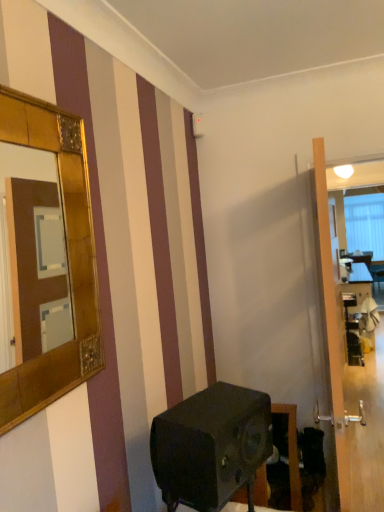
This screenshot has height=512, width=384. What do you see at coordinates (211, 446) in the screenshot?
I see `matte black speaker at lower center` at bounding box center [211, 446].

The image size is (384, 512). I want to click on matte black speaker at lower center, so click(211, 446).

The width and height of the screenshot is (384, 512). In order to click on gold textured mirror at upper left in this screenshot , I will do `click(67, 260)`.

Considering the sizes of objects transparent glass door at right and matte black speaker at lower center in the image provided, who is shorter, transparent glass door at right or matte black speaker at lower center?

matte black speaker at lower center.

Would you say transparent glass door at right is outside matte black speaker at lower center?

Yes, transparent glass door at right is located beyond the bounds of matte black speaker at lower center.

The height and width of the screenshot is (512, 384). I want to click on glass door above the matte black speaker at lower center (from the image's perspective), so click(x=353, y=388).

In the scene shown: Is gold textured mirror at upper left oriented away from matte black speaker at lower center?

No, matte black speaker at lower center is not at the back of gold textured mirror at upper left.

Is gold textured mirror at upper left not within matte black speaker at lower center?

gold textured mirror at upper left lies outside matte black speaker at lower center's area.

Between gold textured mirror at upper left and matte black speaker at lower center, which one has less height?

matte black speaker at lower center.

In the image, there is a gold textured mirror at upper left. Where is `appliance below it (from a real-world perspective)`? The height and width of the screenshot is (512, 384). appliance below it (from a real-world perspective) is located at coordinates (211, 446).

Considering the sizes of matte black speaker at lower center and transparent glass door at right in the image, is matte black speaker at lower center taller or shorter than transparent glass door at right?

matte black speaker at lower center is shorter than transparent glass door at right.

Can you confirm if matte black speaker at lower center is positioned to the right of transparent glass door at right?

Incorrect, matte black speaker at lower center is not on the right side of transparent glass door at right.

Could you tell me if matte black speaker at lower center is turned towards transparent glass door at right?

No, matte black speaker at lower center is not turned towards transparent glass door at right.

From a real-world perspective, between gold textured mirror at upper left and transparent glass door at right, who is vertically lower?

transparent glass door at right is physically lower.

In the scene shown: Is gold textured mirror at upper left facing towards transparent glass door at right?

No.

How many degrees apart are the facing directions of gold textured mirror at upper left and transparent glass door at right?

There is a 3.31-degree angle between the facing directions of gold textured mirror at upper left and transparent glass door at right.

Is the position of matte black speaker at lower center more distant than that of gold textured mirror at upper left?

Yes, matte black speaker at lower center is behind gold textured mirror at upper left.

Who is taller, matte black speaker at lower center or gold textured mirror at upper left?

gold textured mirror at upper left is taller.

Does matte black speaker at lower center appear on the left side of gold textured mirror at upper left?

In fact, matte black speaker at lower center is to the right of gold textured mirror at upper left.

Is matte black speaker at lower center far from gold textured mirror at upper left?

That's not correct — matte black speaker at lower center is a little close to gold textured mirror at upper left.

Is transparent glass door at right facing towards gold textured mirror at upper left?

No, transparent glass door at right is not turned towards gold textured mirror at upper left.

In terms of height, does transparent glass door at right look taller or shorter compared to gold textured mirror at upper left?

Considering their sizes, transparent glass door at right has more height than gold textured mirror at upper left.

Considering the sizes of transparent glass door at right and gold textured mirror at upper left in the image, is transparent glass door at right wider or thinner than gold textured mirror at upper left?

Considering their sizes, transparent glass door at right looks broader than gold textured mirror at upper left.

Would you say transparent glass door at right is a long distance from gold textured mirror at upper left?

transparent glass door at right is positioned a significant distance from gold textured mirror at upper left.

Where is `glass door above the matte black speaker at lower center (from a real-world perspective)`? The width and height of the screenshot is (384, 512). glass door above the matte black speaker at lower center (from a real-world perspective) is located at coordinates (353, 388).

The height and width of the screenshot is (512, 384). In order to click on appliance to the right of gold textured mirror at upper left in this screenshot , I will do `click(211, 446)`.

Based on their spatial positions, is matte black speaker at lower center or transparent glass door at right closer to gold textured mirror at upper left?

Among the two, matte black speaker at lower center is located nearer to gold textured mirror at upper left.

Which object lies further to the anchor point transparent glass door at right, gold textured mirror at upper left or matte black speaker at lower center?

Among the two, gold textured mirror at upper left is located further to transparent glass door at right.

When comparing their distances from matte black speaker at lower center, does transparent glass door at right or gold textured mirror at upper left seem further?

Based on the image, transparent glass door at right appears to be further to matte black speaker at lower center.

When comparing their distances from gold textured mirror at upper left, does transparent glass door at right or matte black speaker at lower center seem closer?

matte black speaker at lower center is closer to gold textured mirror at upper left.

Which object lies further to the anchor point matte black speaker at lower center, gold textured mirror at upper left or transparent glass door at right?

transparent glass door at right is positioned further to the anchor matte black speaker at lower center.

In the scene shown: Which object lies nearer to the anchor point transparent glass door at right, matte black speaker at lower center or gold textured mirror at upper left?

The object closer to transparent glass door at right is matte black speaker at lower center.

You are a GUI agent. You are given a task and a screenshot of the screen. Output one action in this format:
    pyautogui.click(x=<x>, y=<y>)
    Task: Click on the appliance located between gold textured mirror at upper left and transparent glass door at right in the left-right direction
    The image size is (384, 512).
    Given the screenshot: What is the action you would take?
    pyautogui.click(x=211, y=446)